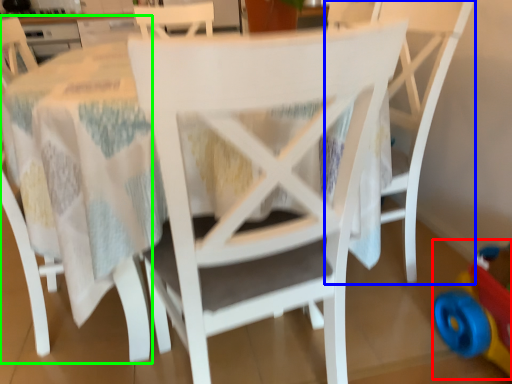
Question: Which object is positioned farthest from toy (highlighted by a red box)? Select from chair (highlighted by a blue box) and chair (highlighted by a green box).

Choices:
 (A) chair
 (B) chair

Answer: (B)